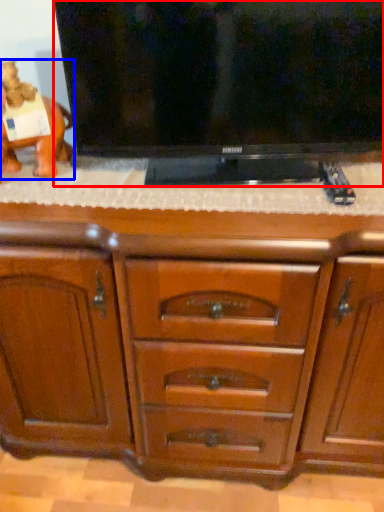
Question: Which object appears closest to the camera in this image, television (highlighted by a red box) or animal (highlighted by a blue box)?

Choices:
 (A) television
 (B) animal

Answer: (A)